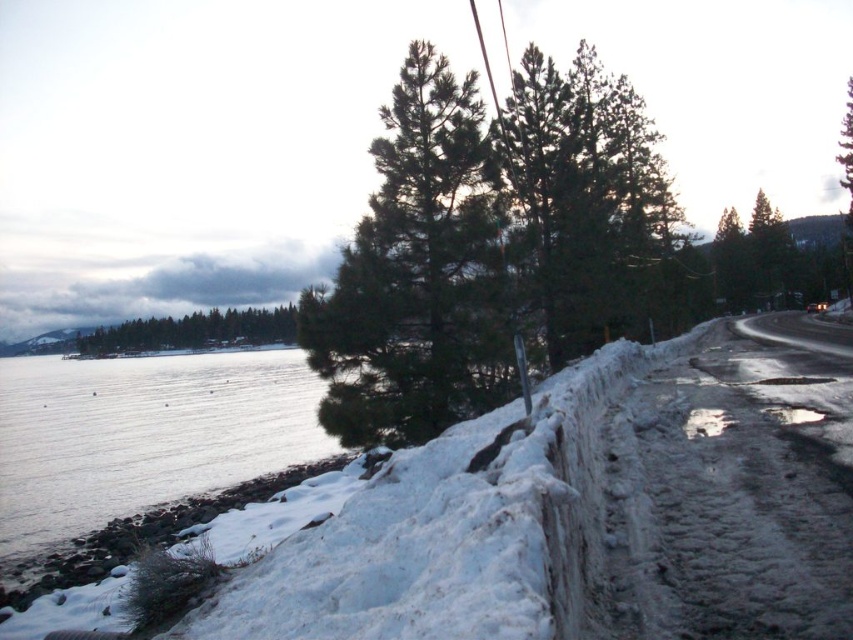
You are standing at the center of the snow embankment and want to reach the clear water at lower left. Which direction should you walk to get there?

The clear water at lower left is located at point (142,435), so you should walk towards the lower left direction to reach it.

You are standing on the lakeside road and want to take a photo of the clear water at lower left and the green matte trees at left. Which object should you focus on first to ensure both are in sharp focus?

You should focus on the green matte trees at left first because the clear water at lower left is in front of them, so focusing on the closer object ensures both will be in focus.